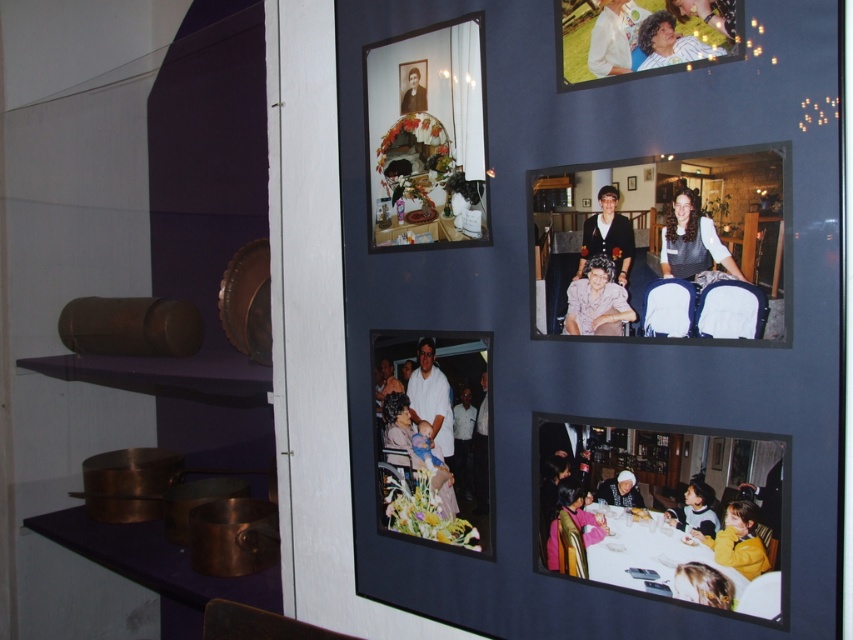
Between point (598, 515) and point (714, 20), which one is positioned in front?

Point (714, 20) is more forward.

The image size is (853, 640). I want to click on pink satin dress at lower right, so click(579, 508).

Who is more distant from viewer, [693,564] or [686,16]?

The point [693,564] is more distant.

Is point (682, 584) in front of point (717, 4)?

No.

Which is in front, point (726, 608) or point (717, 1)?

Positioned in front is point (717, 1).

Find the location of `light brown hair at lower right`. light brown hair at lower right is located at coordinates (701, 584).

Who is positioned more to the left, matte plastic photo frame at lower right or white cotton shirt at center?

white cotton shirt at center is more to the left.

Find the location of a particular element. Image resolution: width=853 pixels, height=640 pixels. matte plastic photo frame at lower right is located at coordinates [665, 513].